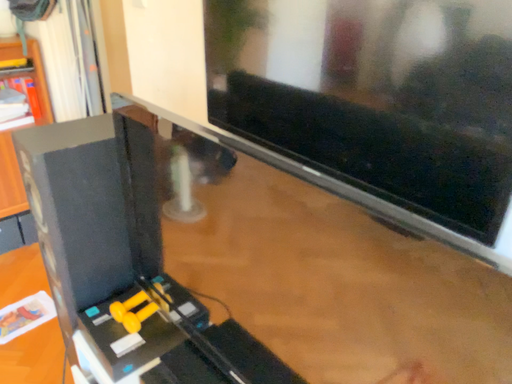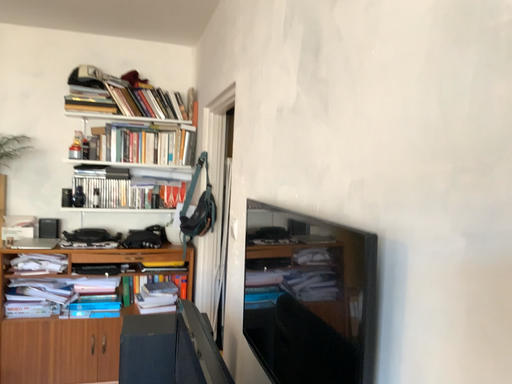
Question: Which way did the camera rotate in the video?

Choices:
 (A) rotated downward
 (B) rotated upward

Answer: (B)